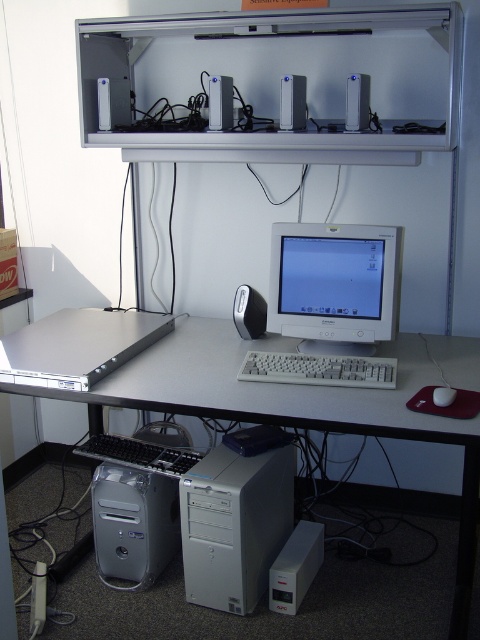
Question: Considering the relative positions of white plastic computer desk at center and black plastic keyboard at lower center in the image provided, where is white plastic computer desk at center located with respect to black plastic keyboard at lower center?

Choices:
 (A) below
 (B) above

Answer: (B)

Question: Where is white plastic computer tower at center located in relation to silver metallic server at lower left in the image?

Choices:
 (A) left
 (B) right

Answer: (B)

Question: Is white plastic computer tower at center in front of white plastic mouse at lower right?

Choices:
 (A) no
 (B) yes

Answer: (A)

Question: Estimate the real-world distances between objects in this image. Which object is farther from the silver metallic server at lower left?

Choices:
 (A) white plastic computer tower at center
 (B) matte gray monitor at center
 (C) white plastic keyboard at center

Answer: (B)

Question: Which point is closer to the camera taking this photo?

Choices:
 (A) pos(244,326)
 (B) pos(387,403)
 (C) pos(220,528)

Answer: (B)

Question: Which object is closer to the camera taking this photo?

Choices:
 (A) white plastic computer desk at center
 (B) white plastic keyboard at center

Answer: (A)